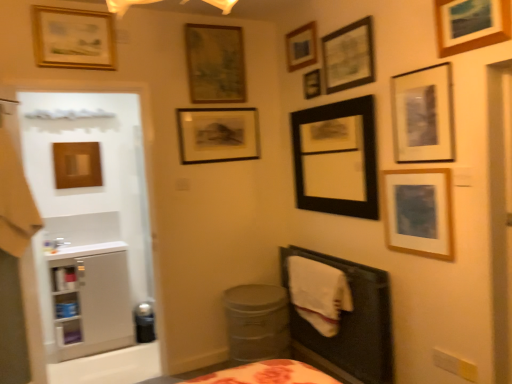
Question: Considering the relative sizes of black matte picture frame at upper center, which is the 7th picture frame from left to right, and matte black picture frame at upper right, placed as the ninth picture frame when sorted from left to right, in the image provided, is black matte picture frame at upper center, which is the 7th picture frame from left to right, taller than matte black picture frame at upper right, placed as the ninth picture frame when sorted from left to right,?

Choices:
 (A) no
 (B) yes

Answer: (B)

Question: Is black matte picture frame at upper center, which is the 7th picture frame from left to right, oriented away from matte black picture frame at upper right, placed as the ninth picture frame when sorted from left to right?

Choices:
 (A) no
 (B) yes

Answer: (A)

Question: From the image's perspective, does black matte picture frame at upper center, which is the 7th picture frame from left to right, appear higher than matte black picture frame at upper right, the 3th picture frame from the right?

Choices:
 (A) yes
 (B) no

Answer: (B)

Question: Is black matte picture frame at upper center, which is the 5th picture frame from right to left, oriented towards matte black picture frame at upper right, placed as the ninth picture frame when sorted from left to right?

Choices:
 (A) no
 (B) yes

Answer: (A)

Question: Can you confirm if black matte picture frame at upper center, which is the 5th picture frame from right to left, is positioned to the right of matte black picture frame at upper right, placed as the ninth picture frame when sorted from left to right?

Choices:
 (A) yes
 (B) no

Answer: (B)

Question: From a real-world perspective, is black plastic potty at lower left, acting as the first potty starting from the left, above or below black matte picture frame at upper center, which is the 5th picture frame from right to left?

Choices:
 (A) below
 (B) above

Answer: (A)

Question: Is point (142, 329) closer or farther from the camera than point (323, 153)?

Choices:
 (A) farther
 (B) closer

Answer: (B)

Question: Is black plastic potty at lower left, acting as the first potty starting from the left, spatially inside black matte picture frame at upper center, which is the 5th picture frame from right to left, or outside of it?

Choices:
 (A) outside
 (B) inside

Answer: (A)

Question: Is black plastic potty at lower left, acting as the first potty starting from the left, taller or shorter than black matte picture frame at upper center, which is the 7th picture frame from left to right?

Choices:
 (A) tall
 (B) short

Answer: (B)

Question: From a real-world perspective, is white soft blanket at lower right physically located above or below metallic gray potty at lower center, placed as the 2th potty when sorted from back to front?

Choices:
 (A) below
 (B) above

Answer: (B)

Question: Is white soft blanket at lower right to the left or to the right of metallic gray potty at lower center, the 2th potty when ordered from left to right, in the image?

Choices:
 (A) left
 (B) right

Answer: (B)

Question: From the image's perspective, is white soft blanket at lower right located above or below metallic gray potty at lower center, placed as the 2th potty when sorted from back to front?

Choices:
 (A) above
 (B) below

Answer: (A)

Question: Considering the positions of white soft blanket at lower right and metallic gray potty at lower center, the 1th potty from the front, in the image, is white soft blanket at lower right bigger or smaller than metallic gray potty at lower center, the 1th potty from the front,?

Choices:
 (A) small
 (B) big

Answer: (A)

Question: From the image's perspective, relative to white soft blanket at lower right, is wooden picture frame at upper center, marked as the seventh picture frame in a right-to-left arrangement, above or below?

Choices:
 (A) below
 (B) above

Answer: (B)

Question: Is wooden picture frame at upper center, which appears as the fifth picture frame when viewed from the left, spatially inside white soft blanket at lower right, or outside of it?

Choices:
 (A) inside
 (B) outside

Answer: (B)